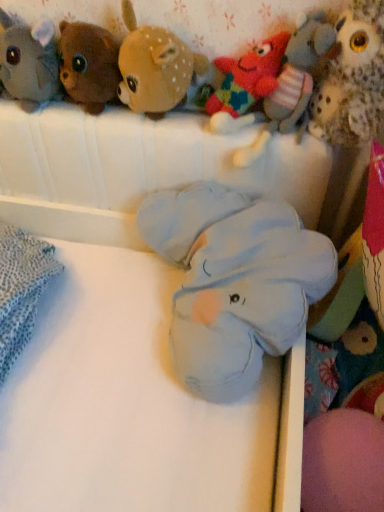
Question: Is knitted wool starfish at upper center, arranged as the fifth toy when viewed from the left, outside of soft blue plush elephant at center?

Choices:
 (A) yes
 (B) no

Answer: (A)

Question: From the image's perspective, is knitted wool starfish at upper center, marked as the 3th toy in a right-to-left arrangement, over soft blue plush elephant at center?

Choices:
 (A) yes
 (B) no

Answer: (A)

Question: Considering the relative positions of knitted wool starfish at upper center, marked as the 3th toy in a right-to-left arrangement, and soft blue plush elephant at center in the image provided, is knitted wool starfish at upper center, marked as the 3th toy in a right-to-left arrangement, to the right of soft blue plush elephant at center from the viewer's perspective?

Choices:
 (A) yes
 (B) no

Answer: (A)

Question: Is knitted wool starfish at upper center, arranged as the fifth toy when viewed from the left, directly adjacent to soft blue plush elephant at center?

Choices:
 (A) no
 (B) yes

Answer: (A)

Question: Is knitted wool starfish at upper center, marked as the 3th toy in a right-to-left arrangement, bigger than soft blue plush elephant at center?

Choices:
 (A) yes
 (B) no

Answer: (B)

Question: Does knitted wool starfish at upper center, marked as the 3th toy in a right-to-left arrangement, contain soft blue plush elephant at center?

Choices:
 (A) no
 (B) yes

Answer: (A)

Question: Considering the relative sizes of soft blue plush elephant at center and brown plush bear at upper left, the second toy positioned from the left, in the image provided, is soft blue plush elephant at center shorter than brown plush bear at upper left, the second toy positioned from the left,?

Choices:
 (A) no
 (B) yes

Answer: (A)

Question: Are soft blue plush elephant at center and brown plush bear at upper left, which is the 6th toy from right to left, making contact?

Choices:
 (A) no
 (B) yes

Answer: (A)

Question: Does soft blue plush elephant at center appear on the right side of brown plush bear at upper left, which is the 6th toy from right to left?

Choices:
 (A) yes
 (B) no

Answer: (B)

Question: Is soft blue plush elephant at center positioned with its back to brown plush bear at upper left, which is the 6th toy from right to left?

Choices:
 (A) yes
 (B) no

Answer: (B)

Question: Are soft blue plush elephant at center and brown plush bear at upper left, which is the 6th toy from right to left, located far from each other?

Choices:
 (A) yes
 (B) no

Answer: (B)

Question: Is the depth of soft blue plush elephant at center greater than that of brown plush bear at upper left, which is the 6th toy from right to left?

Choices:
 (A) yes
 (B) no

Answer: (B)

Question: From a real-world perspective, is fluffy brown owl at upper right, which appears as the seventh toy when viewed from the left, beneath soft blue plush elephant at center, the fourth toy viewed from the left?

Choices:
 (A) yes
 (B) no

Answer: (B)